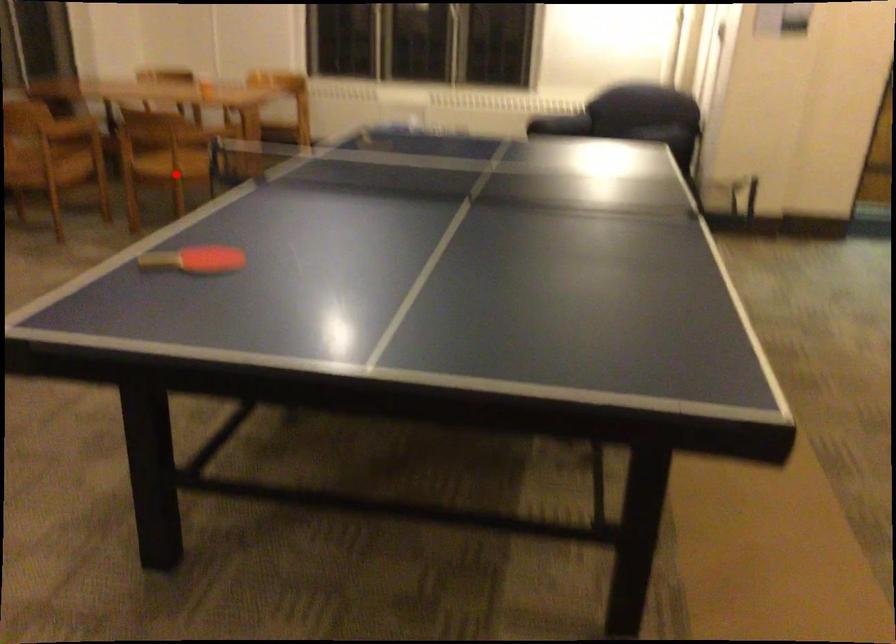
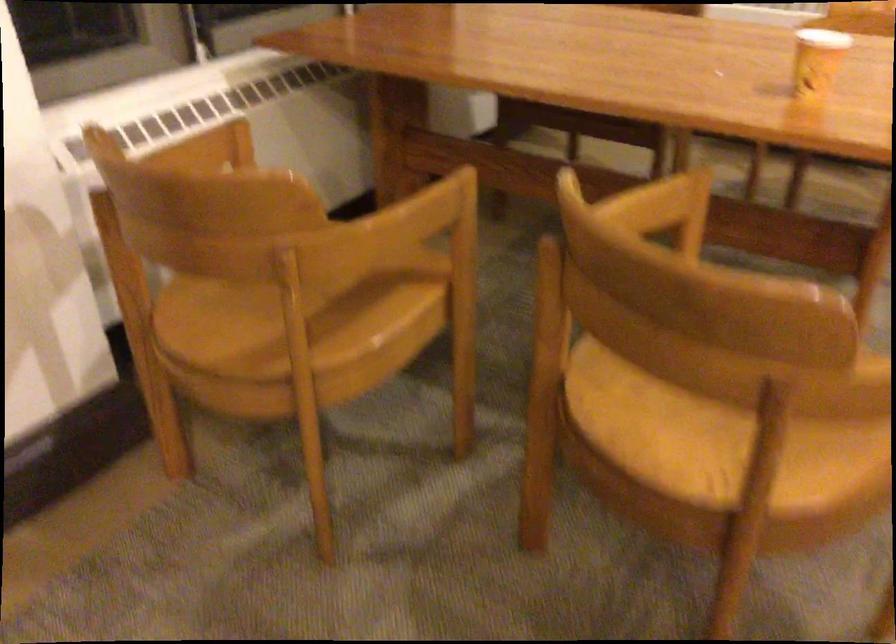
Question: I am providing you with two images of the same scene from different viewpoints. Image1 has a red point marked. In image2, the corresponding 3D location appears at what relative position? Reply with the corresponding letter.

Choices:
 (A) Closer
 (B) Farther

Answer: (A)